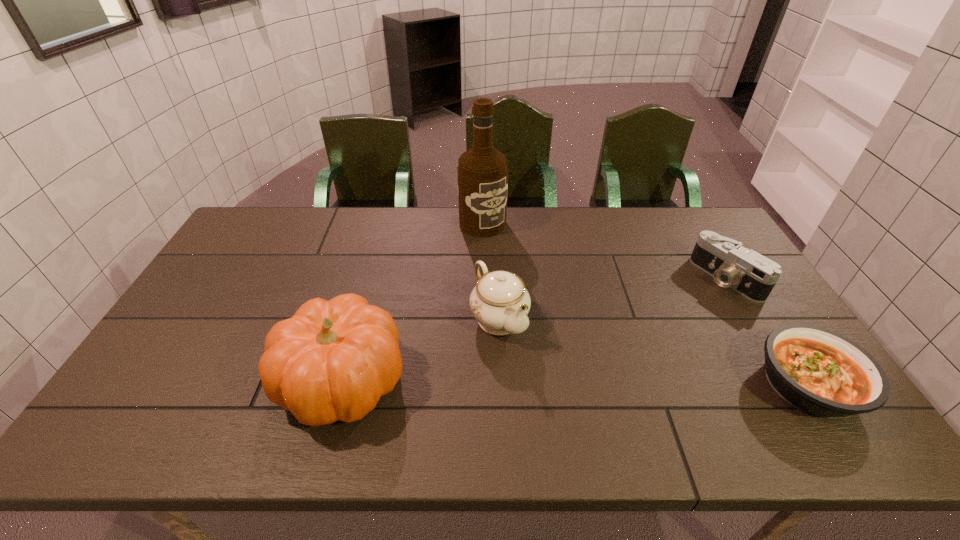
The image size is (960, 540). Find the location of `free spot that satisfies the following two spatial constraints: 1. on the back side of the third tallest object; 2. on the right side of the camera`. free spot that satisfies the following two spatial constraints: 1. on the back side of the third tallest object; 2. on the right side of the camera is located at coordinates (497, 279).

Identify the location of free space that satisfies the following two spatial constraints: 1. on the front side of the alcohol; 2. on the right side of the stew. The height and width of the screenshot is (540, 960). (484, 385).

Locate an element on the screen. The height and width of the screenshot is (540, 960). free location that satisfies the following two spatial constraints: 1. on the back side of the pumpkin; 2. on the left side of the farthest object is located at coordinates click(x=385, y=224).